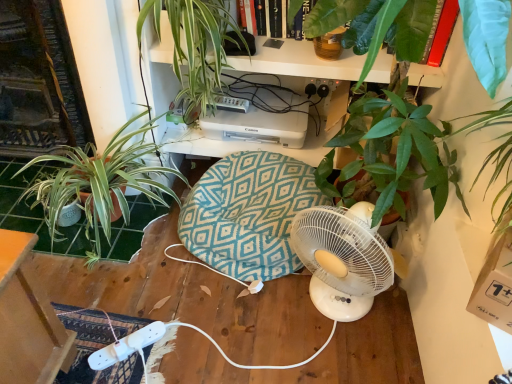
The image size is (512, 384). In order to click on teal fabric swivel chair at center in this screenshot , I will do `click(248, 214)`.

This screenshot has width=512, height=384. Describe the element at coordinates (248, 214) in the screenshot. I see `teal fabric swivel chair at center` at that location.

Describe the element at coordinates (318, 88) in the screenshot. The height and width of the screenshot is (384, 512). I see `black plastic plug at upper center` at that location.

Describe the element at coordinates (196, 46) in the screenshot. This screenshot has width=512, height=384. I see `green leafy plant at upper center, the 2th houseplant from the left` at that location.

Where is `teal fabric swivel chair at center`? teal fabric swivel chair at center is located at coordinates (248, 214).

Is green leafy plant at upper center, the 1th houseplant from the right, taller than black plastic plug at upper center?

Yes.

Locate an element on the screen. The height and width of the screenshot is (384, 512). plug located on the right of green leafy plant at upper center, the 2th houseplant from the left is located at coordinates (318, 88).

Does point (191, 0) come behind point (317, 87)?

No, (191, 0) is closer to viewer.

Consider the image. From the image's perspective, is green leafy plant at left, the 2th houseplant viewed from the right, over black plastic plug at upper center?

Incorrect, from the image's perspective, green leafy plant at left, the 2th houseplant viewed from the right, is lower than black plastic plug at upper center.

Is green leafy plant at left, the 2th houseplant viewed from the right, completely or partially outside of black plastic plug at upper center?

Absolutely, green leafy plant at left, the 2th houseplant viewed from the right, is external to black plastic plug at upper center.

Is green leafy plant at left, the first houseplant when ordered from left to right, facing away from black plastic plug at upper center?

No, green leafy plant at left, the first houseplant when ordered from left to right, is not facing away from black plastic plug at upper center.

Between point (182, 11) and point (128, 186), which one is positioned behind?

The point (128, 186) is more distant.

Is green leafy plant at upper center, the 1th houseplant from the right, to the left of green leafy plant at left, the 2th houseplant viewed from the right, from the viewer's perspective?

No.

From the image's perspective, which one is positioned higher, green leafy plant at upper center, the 1th houseplant from the right, or green leafy plant at left, the 2th houseplant viewed from the right?

green leafy plant at upper center, the 1th houseplant from the right.

Is green leafy plant at upper center, the 1th houseplant from the right, spatially inside green leafy plant at left, the first houseplant when ordered from left to right, or outside of it?

green leafy plant at upper center, the 1th houseplant from the right, is located beyond the bounds of green leafy plant at left, the first houseplant when ordered from left to right.

Can you confirm if black plastic plug at upper center is taller than teal fabric swivel chair at center?

No.

Can we say black plastic plug at upper center lies outside teal fabric swivel chair at center?

That's correct, black plastic plug at upper center is outside of teal fabric swivel chair at center.

Is black plastic plug at upper center directly adjacent to teal fabric swivel chair at center?

No, black plastic plug at upper center is not making contact with teal fabric swivel chair at center.

In the scene shown: Does black plastic plug at upper center turn towards teal fabric swivel chair at center?

No.

How different are the orientations of teal fabric swivel chair at center and green leafy plant at upper center, the 1th houseplant from the right, in degrees?

The angle between the facing direction of teal fabric swivel chair at center and the facing direction of green leafy plant at upper center, the 1th houseplant from the right, is 1.25 degrees.

From the image's perspective, which one is positioned lower, teal fabric swivel chair at center or green leafy plant at upper center, the 2th houseplant from the left?

From the image's view, teal fabric swivel chair at center is below.

Between teal fabric swivel chair at center and green leafy plant at upper center, the 1th houseplant from the right, which one has less height?

teal fabric swivel chair at center.

Can you tell me how much black plastic plug at upper center and green leafy plant at upper center, the 2th houseplant from the left, differ in facing direction?

black plastic plug at upper center and green leafy plant at upper center, the 2th houseplant from the left, are facing 0.263 degrees away from each other.

Would you say black plastic plug at upper center contains green leafy plant at upper center, the 2th houseplant from the left?

No, green leafy plant at upper center, the 2th houseplant from the left, is located outside of black plastic plug at upper center.

From the image's perspective, is black plastic plug at upper center located above or below green leafy plant at upper center, the 2th houseplant from the left?

From the image's perspective, black plastic plug at upper center appears below green leafy plant at upper center, the 2th houseplant from the left.

The image size is (512, 384). I want to click on houseplant that appears above the black plastic plug at upper center (from the image's perspective), so [196, 46].

Is point (234, 179) closer to camera compared to point (317, 90)?

Yes, it is in front of point (317, 90).

Is teal fabric swivel chair at center located outside black plastic plug at upper center?

Yes, teal fabric swivel chair at center is not within black plastic plug at upper center.

Who is smaller, teal fabric swivel chair at center or black plastic plug at upper center?

With smaller size is black plastic plug at upper center.

Measure the distance from teal fabric swivel chair at center to black plastic plug at upper center.

teal fabric swivel chair at center and black plastic plug at upper center are 25.24 inches apart from each other.

Locate an element on the screen. The width and height of the screenshot is (512, 384). plug behind the green leafy plant at upper center, the 1th houseplant from the right is located at coordinates (318, 88).

Where is `houseplant below the black plastic plug at upper center (from a real-world perspective)`? This screenshot has width=512, height=384. houseplant below the black plastic plug at upper center (from a real-world perspective) is located at coordinates (99, 184).

Based on their spatial positions, is green leafy plant at left, the 2th houseplant viewed from the right, or green leafy plant at upper center, the 2th houseplant from the left, further from teal fabric swivel chair at center?

Based on the image, green leafy plant at upper center, the 2th houseplant from the left, appears to be further to teal fabric swivel chair at center.

Based on their spatial positions, is teal fabric swivel chair at center or black plastic plug at upper center closer to green leafy plant at upper center, the 1th houseplant from the right?

Among the two, teal fabric swivel chair at center is located nearer to green leafy plant at upper center, the 1th houseplant from the right.

Which object lies nearer to the anchor point black plastic plug at upper center, green leafy plant at left, the first houseplant when ordered from left to right, or teal fabric swivel chair at center?

teal fabric swivel chair at center lies closer to black plastic plug at upper center than the other object.

Looking at the image, which one is located further to black plastic plug at upper center, green leafy plant at upper center, the 2th houseplant from the left, or green leafy plant at left, the first houseplant when ordered from left to right?

green leafy plant at left, the first houseplant when ordered from left to right.

Based on the photo, based on their spatial positions, is green leafy plant at upper center, the 1th houseplant from the right, or teal fabric swivel chair at center further from black plastic plug at upper center?

Among the two, teal fabric swivel chair at center is located further to black plastic plug at upper center.

Based on their spatial positions, is black plastic plug at upper center or green leafy plant at upper center, the 2th houseplant from the left, further from green leafy plant at left, the first houseplant when ordered from left to right?

The object further to green leafy plant at left, the first houseplant when ordered from left to right, is black plastic plug at upper center.

Which object lies nearer to the anchor point green leafy plant at upper center, the 1th houseplant from the right, teal fabric swivel chair at center or green leafy plant at left, the 2th houseplant viewed from the right?

The object closer to green leafy plant at upper center, the 1th houseplant from the right, is green leafy plant at left, the 2th houseplant viewed from the right.

When comparing their distances from green leafy plant at left, the 2th houseplant viewed from the right, does teal fabric swivel chair at center or green leafy plant at upper center, the 2th houseplant from the left, seem further?

green leafy plant at upper center, the 2th houseplant from the left.

The width and height of the screenshot is (512, 384). Find the location of `swivel chair between green leafy plant at left, the first houseplant when ordered from left to right, and black plastic plug at upper center, in the horizontal direction`. swivel chair between green leafy plant at left, the first houseplant when ordered from left to right, and black plastic plug at upper center, in the horizontal direction is located at coordinates (248, 214).

Where is `houseplant between green leafy plant at upper center, the 1th houseplant from the right, and teal fabric swivel chair at center in the up-down direction`? The image size is (512, 384). houseplant between green leafy plant at upper center, the 1th houseplant from the right, and teal fabric swivel chair at center in the up-down direction is located at coordinates (99, 184).

You are a GUI agent. You are given a task and a screenshot of the screen. Output one action in this format:
    pyautogui.click(x=<x>, y=<y>)
    Task: Click on the swivel chair between green leafy plant at upper center, the 2th houseplant from the left, and black plastic plug at upper center in the front-back direction
    Image resolution: width=512 pixels, height=384 pixels.
    Given the screenshot: What is the action you would take?
    pyautogui.click(x=248, y=214)

Identify the location of houseplant situated between green leafy plant at left, the 2th houseplant viewed from the right, and black plastic plug at upper center from left to right. This screenshot has width=512, height=384. (196, 46).